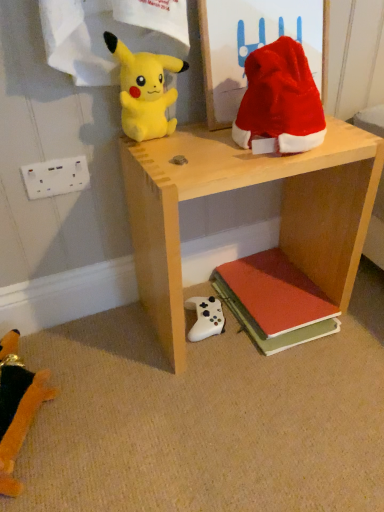
Find the location of `vacant space behind velvet orange stuffed toy at lower left, which ranks as the fourth toy in right-to-left order`. vacant space behind velvet orange stuffed toy at lower left, which ranks as the fourth toy in right-to-left order is located at coordinates (74, 338).